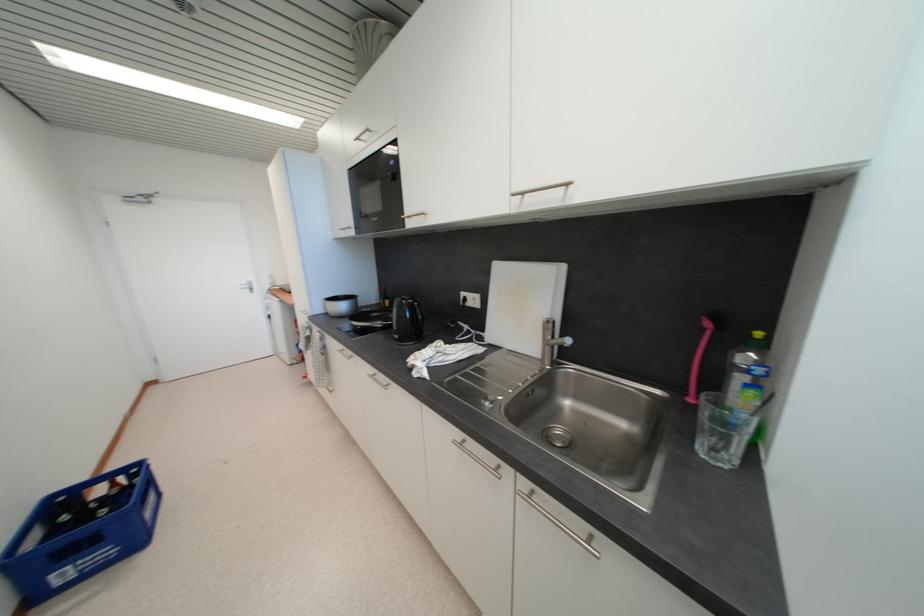
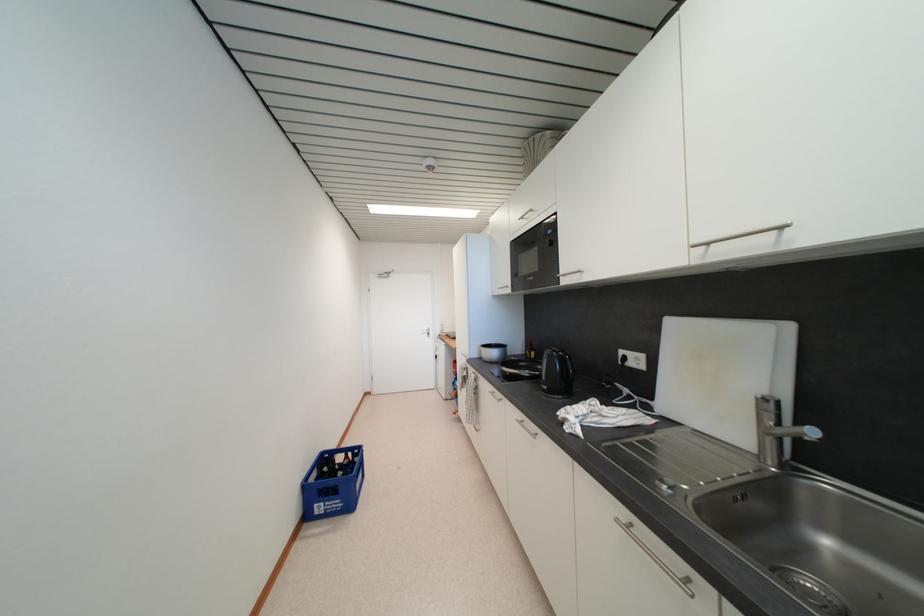
Question: The camera is either moving clockwise (left) or counter-clockwise (right) around the object. The first image is from the beginning of the video and the second image is from the end. Is the camera moving left or right when shooting the video?

Choices:
 (A) Left
 (B) Right

Answer: (B)